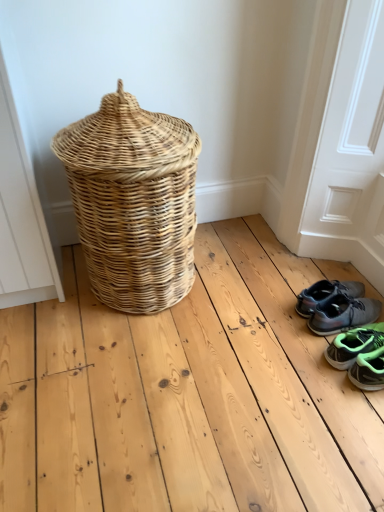
Question: From the image's perspective, is neon green synthetic sneakers at lower right, marked as the 1th footwear in a front-to-back arrangement, positioned above or below gray synthetic sneakers at lower right, which is the 3th footwear from front to back?

Choices:
 (A) above
 (B) below

Answer: (B)

Question: Looking at the image, does neon green synthetic sneakers at lower right, marked as the 1th footwear in a front-to-back arrangement, seem bigger or smaller compared to gray synthetic sneakers at lower right, which is the 3th footwear from front to back?

Choices:
 (A) small
 (B) big

Answer: (A)

Question: Estimate the real-world distances between objects in this image. Which object is farther from the gray fabric sneakers at lower right, which is counted as the 2th footwear, starting from the front?

Choices:
 (A) white matte screen door at lower right
 (B) neon green synthetic sneakers at lower right, arranged as the third footwear when viewed from the back
 (C) gray synthetic sneakers at lower right, which is the 3th footwear from front to back
 (D) natural wicker basket at left

Answer: (D)

Question: Which object is positioned closest to the natural wicker basket at left?

Choices:
 (A) gray fabric sneakers at lower right, which appears as the second footwear when viewed from the back
 (B) neon green synthetic sneakers at lower right, arranged as the third footwear when viewed from the back
 (C) white matte screen door at lower right
 (D) gray synthetic sneakers at lower right, which is the 3th footwear from front to back

Answer: (C)